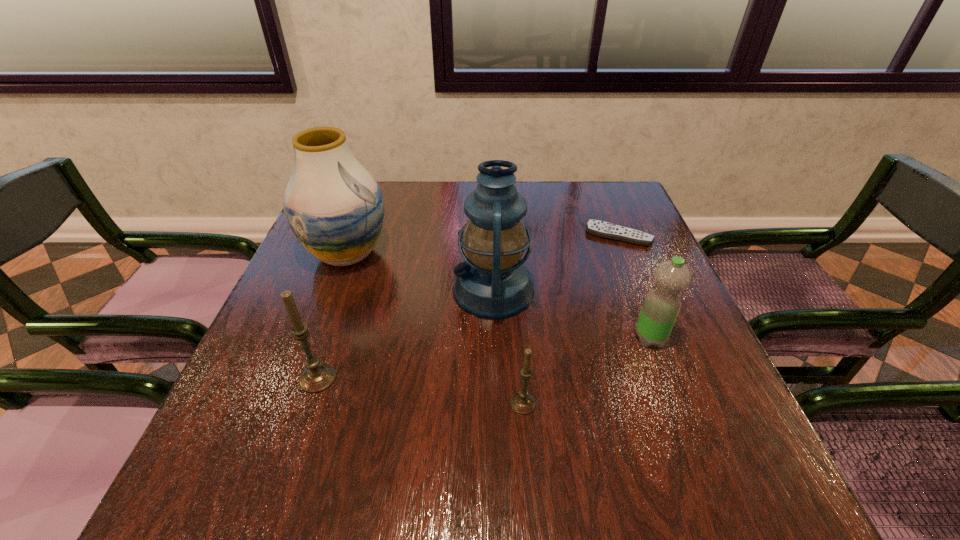
The height and width of the screenshot is (540, 960). What are the coordinates of `vacant point that satisfies the following two spatial constraints: 1. on the back side of the fifth tallest object; 2. on the right side of the water bottle` in the screenshot? It's located at (517, 338).

Where is `free location that satisfies the following two spatial constraints: 1. on the back side of the shortest object; 2. on the left side of the water bottle`? This screenshot has width=960, height=540. free location that satisfies the following two spatial constraints: 1. on the back side of the shortest object; 2. on the left side of the water bottle is located at coordinates pyautogui.click(x=611, y=235).

At what (x,y) coordinates should I click in order to perform the action: click on vacant space that satisfies the following two spatial constraints: 1. on the back side of the water bottle; 2. on the face of the lantern. Please return your answer as a coordinate pair (x, y). Looking at the image, I should click on click(632, 290).